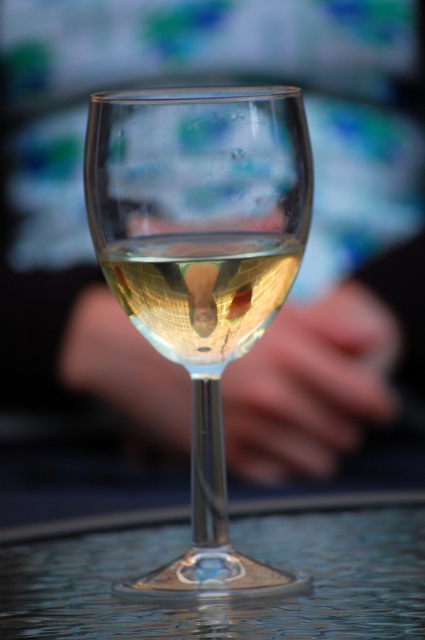
Is transparent glass at center bigger than clear glass wine at center?

Correct, transparent glass at center is larger in size than clear glass wine at center.

Between transparent glass at center and clear glass wine at center, which one has more height?

With more height is clear glass wine at center.

Between point (418, 529) and point (204, 339), which one is positioned in front?

Point (204, 339) is in front.

Locate an element on the screen. The height and width of the screenshot is (640, 425). transparent glass at center is located at coordinates (226, 602).

I want to click on transparent glass wine glass at center, so click(x=201, y=268).

Which is more to the right, transparent glass wine glass at center or transparent glass at center?

Positioned to the right is transparent glass at center.

Between point (209, 392) and point (274, 522), which one is positioned behind?

Positioned behind is point (274, 522).

At what (x,y) coordinates should I click in order to perform the action: click on transparent glass wine glass at center. Please return your answer as a coordinate pair (x, y). Image resolution: width=425 pixels, height=640 pixels. Looking at the image, I should click on (201, 268).

Is point (164, 589) less distant than point (180, 262)?

No, (164, 589) is behind (180, 262).

Between transparent glass wine glass at center and clear glass wine at center, which one has less height?

With less height is clear glass wine at center.

Describe the element at coordinates (201, 268) in the screenshot. I see `transparent glass wine glass at center` at that location.

Find the location of a particular element. transparent glass wine glass at center is located at coordinates (201, 268).